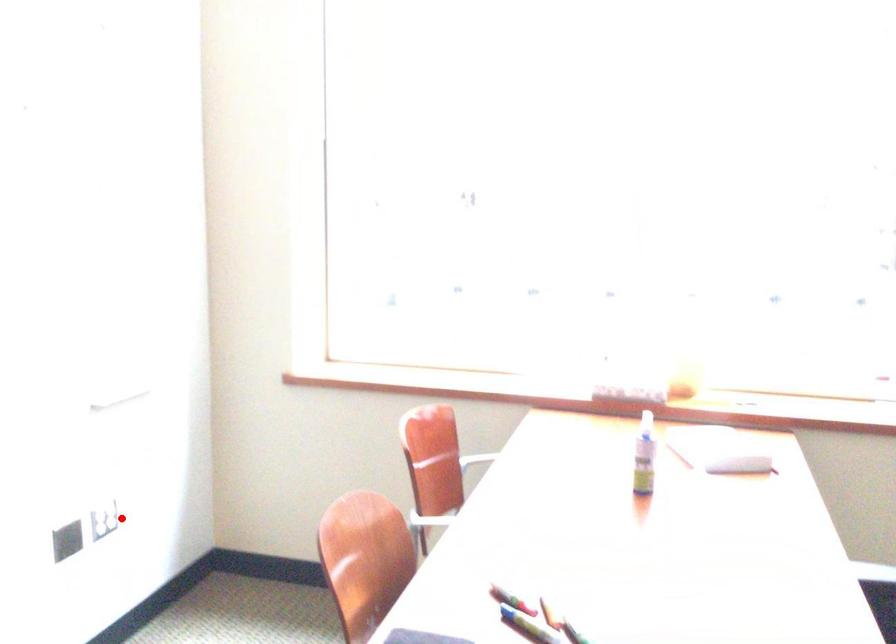
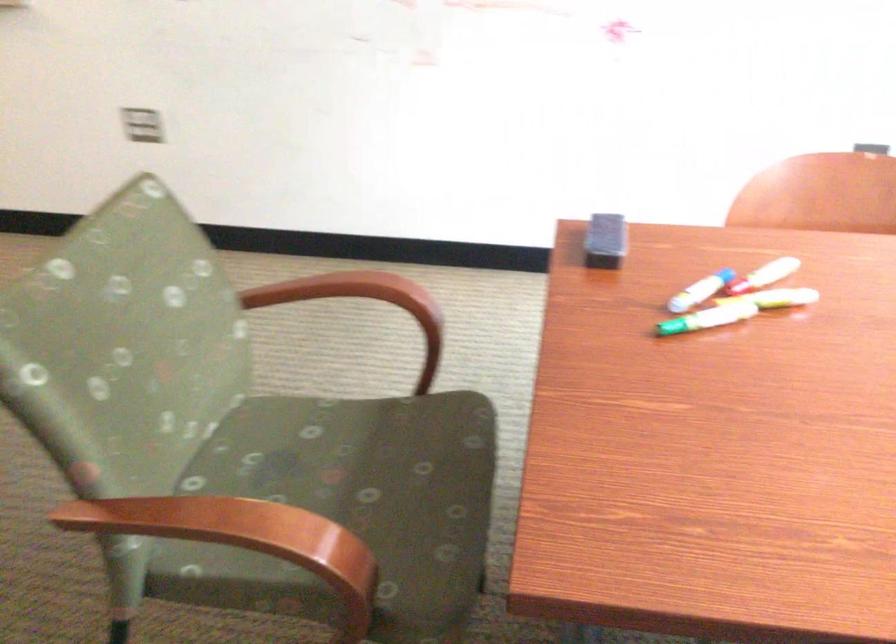
Question: I am providing you with two images of the same scene from different viewpoints. A red point is shown in image1. For the corresponding object point in image2, is it positioned nearer or farther from the camera?

Choices:
 (A) Nearer
 (B) Farther

Answer: (A)